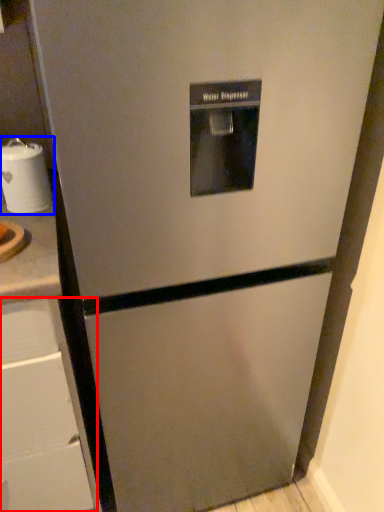
Question: Which object is further to the camera taking this photo, drawer (highlighted by a red box) or appliance (highlighted by a blue box)?

Choices:
 (A) drawer
 (B) appliance

Answer: (B)